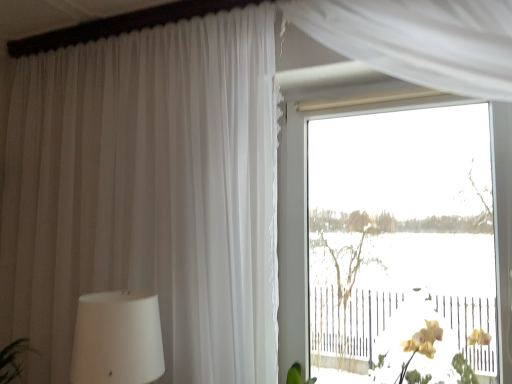
Question: Do you think metallic silver rail at lower right is within transparent glass window at center, or outside of it?

Choices:
 (A) outside
 (B) inside

Answer: (A)

Question: From their relative heights in the image, would you say metallic silver rail at lower right is taller or shorter than transparent glass window at center?

Choices:
 (A) short
 (B) tall

Answer: (A)

Question: Considering their positions, is metallic silver rail at lower right located in front of or behind transparent glass window at center?

Choices:
 (A) behind
 (B) front

Answer: (B)

Question: From the image's perspective, relative to metallic silver rail at lower right, is transparent glass window at center above or below?

Choices:
 (A) below
 (B) above

Answer: (B)

Question: From a real-world perspective, is transparent glass window at center above or below metallic silver rail at lower right?

Choices:
 (A) below
 (B) above

Answer: (B)

Question: Is transparent glass window at center bigger or smaller than metallic silver rail at lower right?

Choices:
 (A) small
 (B) big

Answer: (B)

Question: Is point (502, 226) positioned closer to the camera than point (355, 349)?

Choices:
 (A) farther
 (B) closer

Answer: (B)